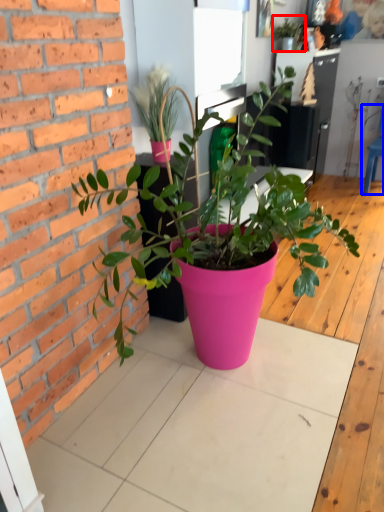
Question: Which object appears farthest to the camera in this image, houseplant (highlighted by a red box) or chair (highlighted by a blue box)?

Choices:
 (A) houseplant
 (B) chair

Answer: (B)